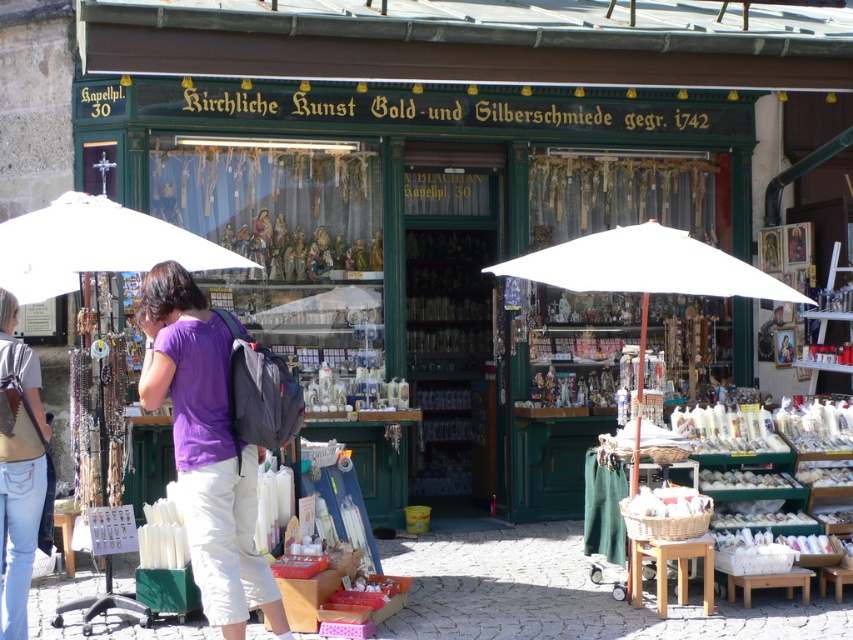
Does point (157, 300) come closer to viewer compared to point (4, 586)?

Yes, it is.

Consider the image. Which is more to the right, purple fabric shirt at center or denim jeans at lower left?

From the viewer's perspective, purple fabric shirt at center appears more on the right side.

Where is `purple fabric shirt at center`? The width and height of the screenshot is (853, 640). purple fabric shirt at center is located at coordinates (206, 449).

Who is higher up, purple fabric shirt at center or white fabric umbrella at center?

white fabric umbrella at center is higher up.

Which is behind, point (215, 568) or point (560, 256)?

Point (560, 256)

This screenshot has height=640, width=853. I want to click on purple fabric shirt at center, so click(x=206, y=449).

Looking at this image, does white fabric umbrella at center appear under denim jeans at lower left?

No.

Is point (624, 259) more distant than point (10, 509)?

Yes, point (624, 259) is farther from viewer.

Is point (556, 280) less distant than point (7, 296)?

No, it is behind (7, 296).

The height and width of the screenshot is (640, 853). I want to click on white fabric umbrella at center, so click(x=645, y=269).